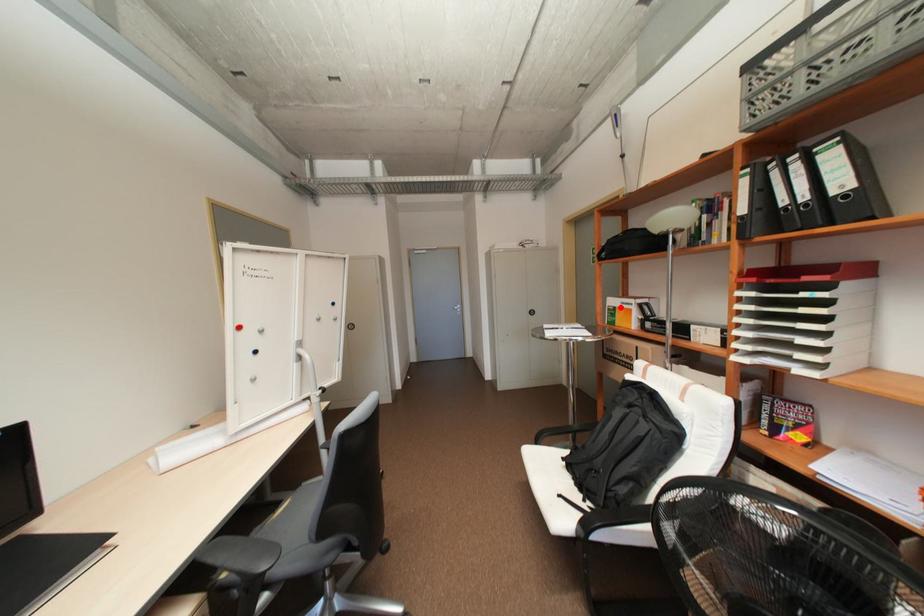
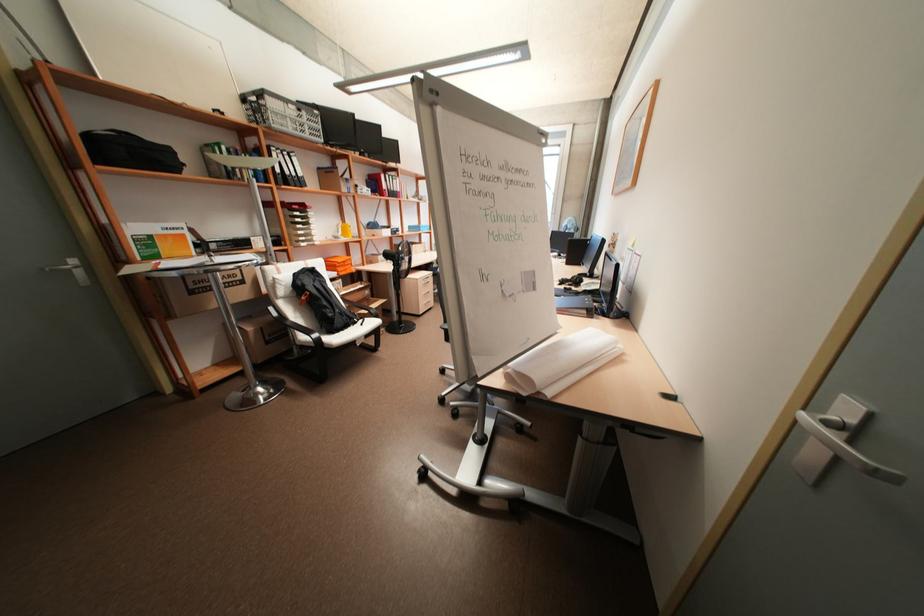
Locate, in the second image, the point that corresponds to the highlighted location in the first image.

(155, 236)